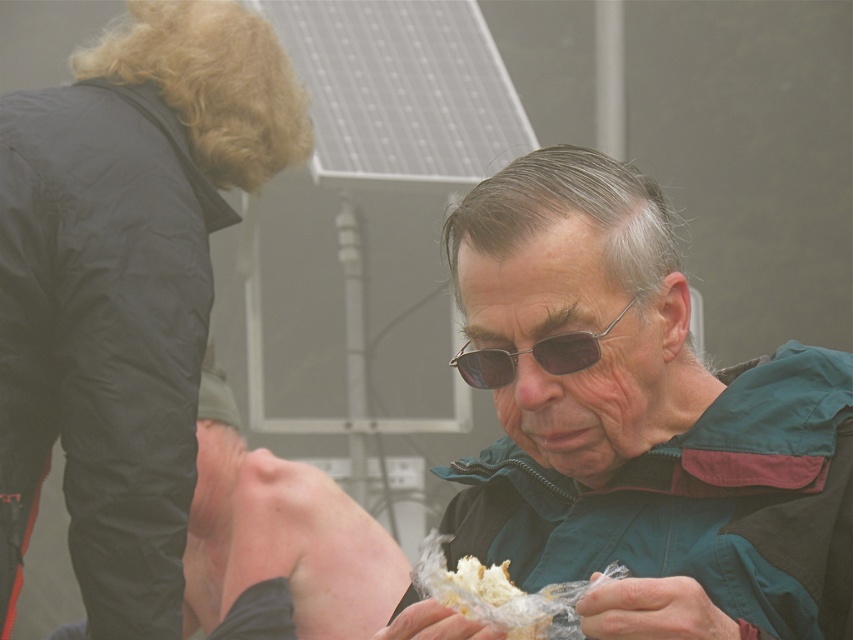
Does matte black jacket at lower right appear on the left side of sunglasses at center?

Indeed, matte black jacket at lower right is positioned on the left side of sunglasses at center.

Between point (236, 464) and point (540, 356), which one is positioned in front?

Point (540, 356)

What do you see at coordinates (279, 545) in the screenshot? The image size is (853, 640). I see `matte black jacket at lower right` at bounding box center [279, 545].

Identify the location of matte black jacket at lower right. The width and height of the screenshot is (853, 640). tap(279, 545).

Is point (792, 410) positioned in front of point (537, 362)?

No, it is not.

Is green fabric jacket at center to the left of sunglasses at center from the viewer's perspective?

Incorrect, green fabric jacket at center is not on the left side of sunglasses at center.

Who is more forward, [669,540] or [474,362]?

Point [669,540] is more forward.

Where is `green fabric jacket at center`? The image size is (853, 640). green fabric jacket at center is located at coordinates (639, 420).

Describe the element at coordinates (279, 545) in the screenshot. I see `matte black jacket at lower right` at that location.

Who is more distant from viewer, (x=199, y=531) or (x=496, y=604)?

Point (x=199, y=531)

The image size is (853, 640). Identify the location of matte black jacket at lower right. (279, 545).